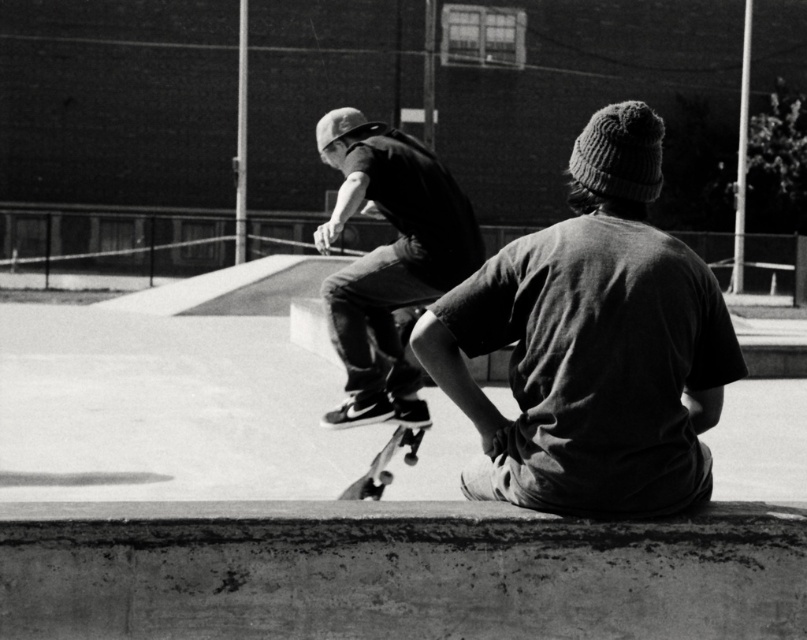
Measure the distance between knit cap at center and matte black skateboard at center.

The distance of knit cap at center from matte black skateboard at center is 3.05 meters.

Does knit cap at center appear under matte black skateboard at center?

Actually, knit cap at center is above matte black skateboard at center.

Describe the element at coordinates (592, 344) in the screenshot. Image resolution: width=807 pixels, height=640 pixels. I see `knit cap at center` at that location.

Locate an element on the screen. The width and height of the screenshot is (807, 640). knit cap at center is located at coordinates (592, 344).

Between matte black skateboard at center and smooth black skateboard at center, which one appears on the left side from the viewer's perspective?

smooth black skateboard at center

Who is shorter, matte black skateboard at center or smooth black skateboard at center?

Standing shorter between the two is matte black skateboard at center.

Where is `matte black skateboard at center`? The width and height of the screenshot is (807, 640). matte black skateboard at center is located at coordinates (387, 259).

Which is behind, point (630, 470) or point (346, 497)?

Point (346, 497)

Image resolution: width=807 pixels, height=640 pixels. What do you see at coordinates (592, 344) in the screenshot?
I see `knit cap at center` at bounding box center [592, 344].

Between point (523, 433) and point (374, 477), which one is positioned behind?

The point (374, 477) is behind.

Find the location of `knit cap at center`. knit cap at center is located at coordinates (592, 344).